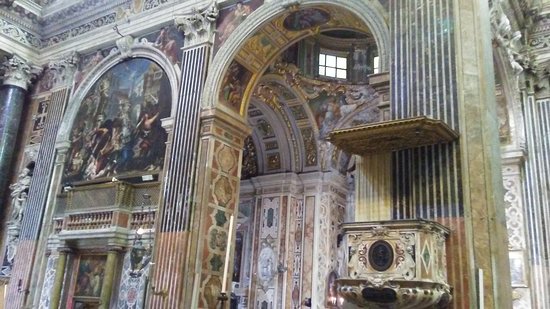
I want to click on art, so click(x=170, y=136).